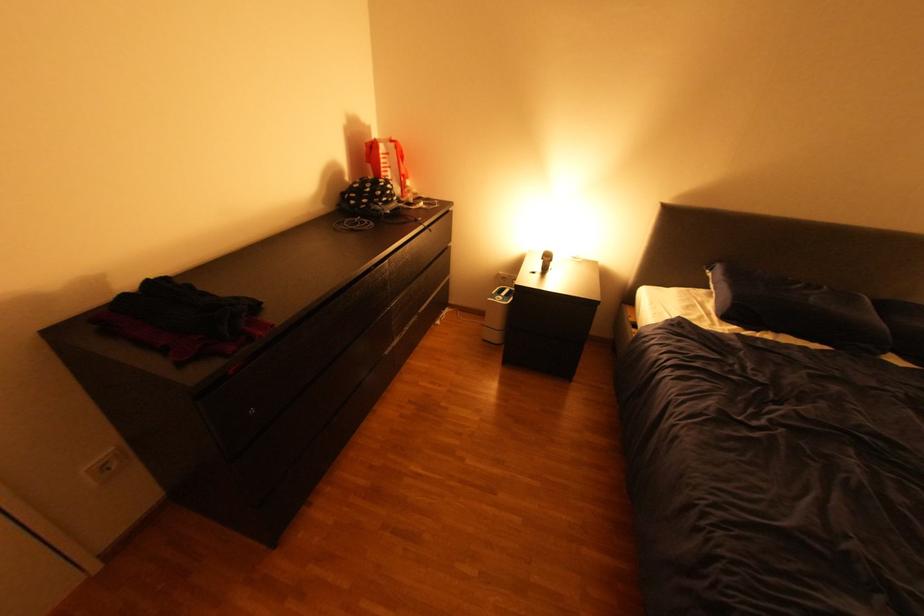
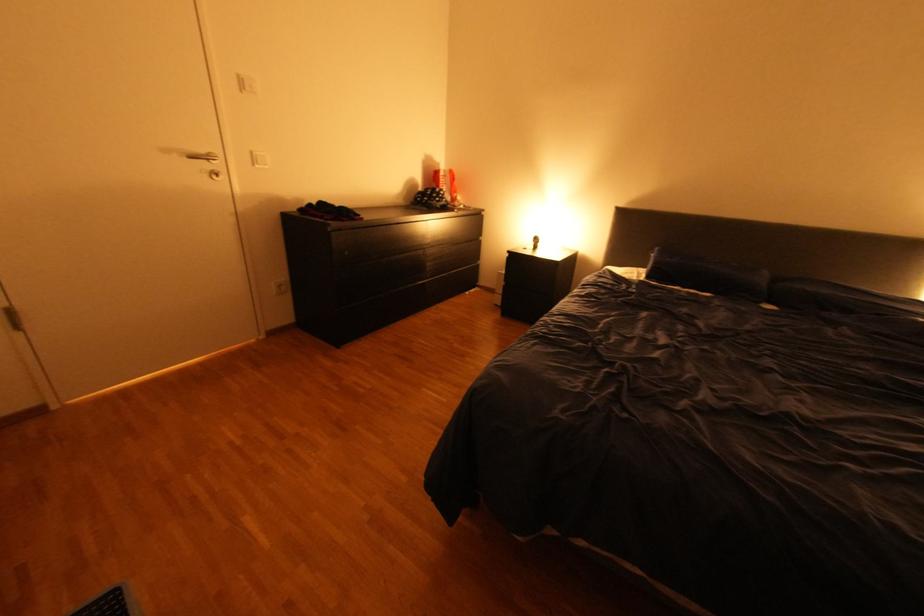
What movement of the cameraman would produce the second image?

The movement direction of the cameraman is right, backward.